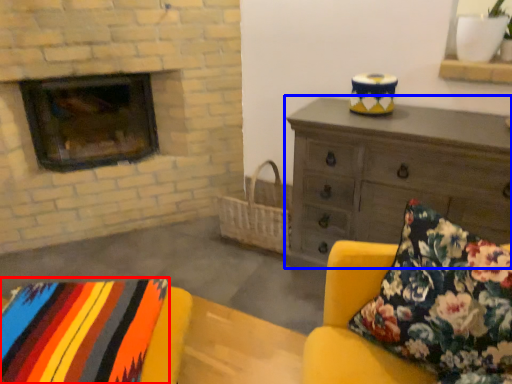
Question: Among these objects, which one is farthest to the camera, blanket (highlighted by a red box) or chest of drawers (highlighted by a blue box)?

Choices:
 (A) blanket
 (B) chest of drawers

Answer: (B)